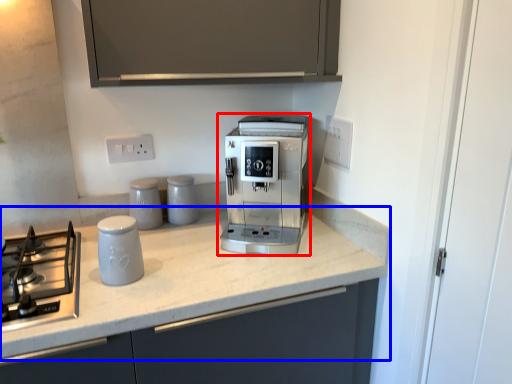
Question: Which of the following is the closest to the observer, coffee maker (highlighted by a red box) or countertop (highlighted by a blue box)?

Choices:
 (A) coffee maker
 (B) countertop

Answer: (B)